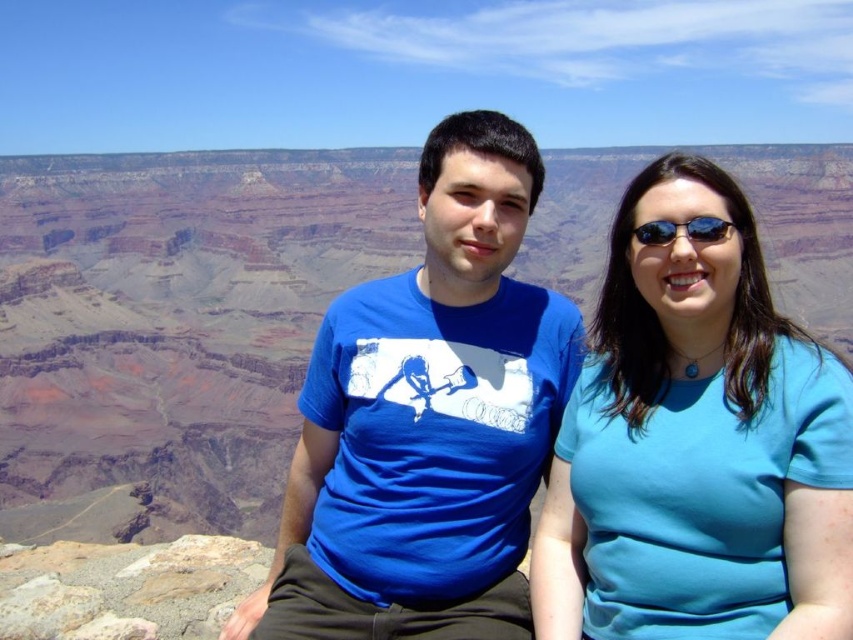
Question: Can you confirm if blue fabric shirt at center is positioned to the left of blue cotton t-shirt at center?

Choices:
 (A) yes
 (B) no

Answer: (B)

Question: Which object is the farthest from the blue fabric shirt at center?

Choices:
 (A) sunglasses at upper right
 (B) blue cotton t-shirt at center

Answer: (B)

Question: Is blue cotton t-shirt at center wider than sunglasses at upper right?

Choices:
 (A) no
 (B) yes

Answer: (B)

Question: Which object is farther from the camera taking this photo?

Choices:
 (A) blue cotton t-shirt at center
 (B) blue fabric shirt at center
 (C) sunglasses at upper right

Answer: (C)

Question: Among these points, which one is nearest to the camera?

Choices:
 (A) (637, 564)
 (B) (663, 236)

Answer: (A)

Question: Can you confirm if blue cotton t-shirt at center is positioned to the left of sunglasses at upper right?

Choices:
 (A) no
 (B) yes

Answer: (B)